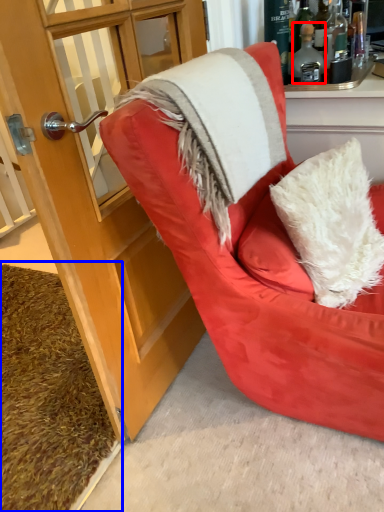
Question: Which of the following is the farthest to the observer, bottle (highlighted by a red box) or doormat (highlighted by a blue box)?

Choices:
 (A) bottle
 (B) doormat

Answer: (A)